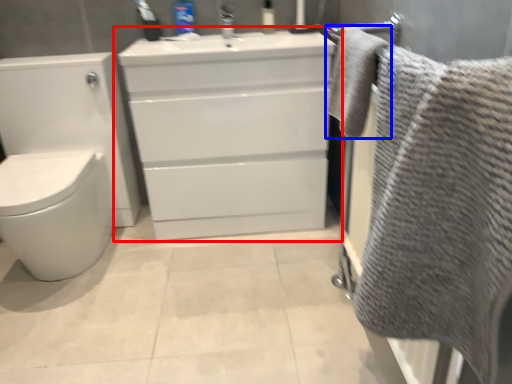
Question: Which point is closer to the camera, bathroom cabinet (highlighted by a red box) or bath towel (highlighted by a blue box)?

Choices:
 (A) bathroom cabinet
 (B) bath towel

Answer: (B)